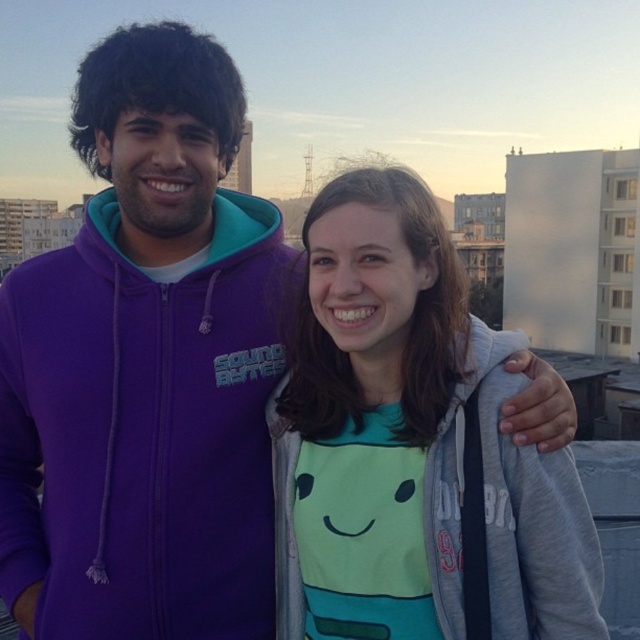
From the picture: Is purple fleece jacket at center below light gray hoodie at center?

Actually, purple fleece jacket at center is above light gray hoodie at center.

Who is higher up, purple fleece jacket at center or light gray hoodie at center?

purple fleece jacket at center

Describe the element at coordinates (145, 365) in the screenshot. I see `purple fleece jacket at center` at that location.

At what (x,y) coordinates should I click in order to perform the action: click on purple fleece jacket at center. Please return your answer as a coordinate pair (x, y). Image resolution: width=640 pixels, height=640 pixels. Looking at the image, I should click on (145, 365).